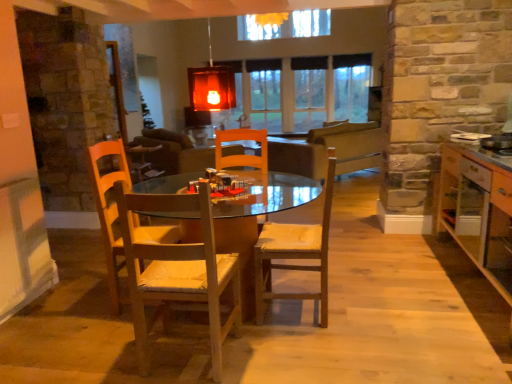
This screenshot has height=384, width=512. In order to click on vacant space situated on the left part of wooden cabinet at right in this screenshot , I will do `click(400, 305)`.